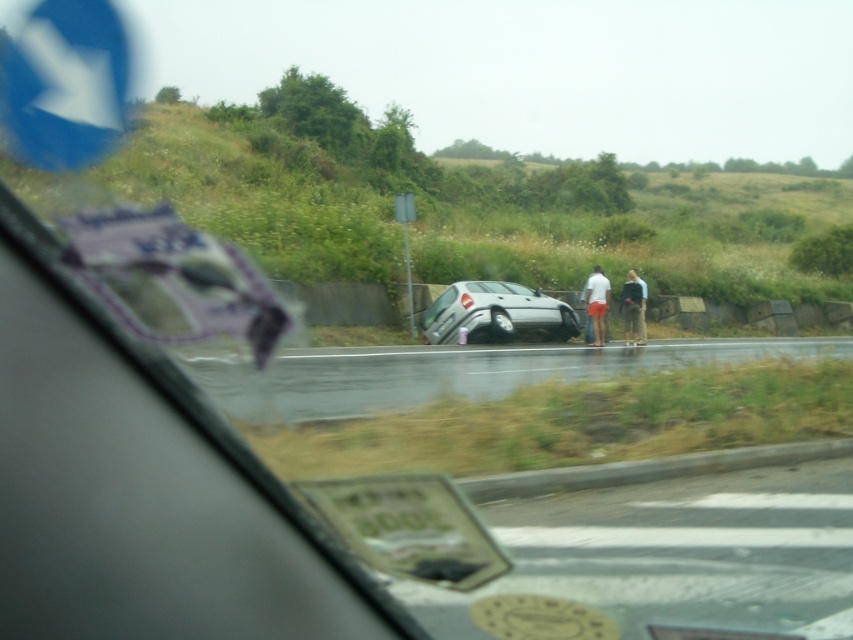
Question: Does matte white shorts at center have a larger size compared to light blue jeans at center?

Choices:
 (A) yes
 (B) no

Answer: (A)

Question: Which point appears farthest from the camera in this image?

Choices:
 (A) (471, 280)
 (B) (595, 269)
 (C) (631, 307)

Answer: (A)

Question: Is satin silver car at center wider than light blue jeans at center?

Choices:
 (A) no
 (B) yes

Answer: (B)

Question: Which point is closer to the camera taking this photo?

Choices:
 (A) (422, 346)
 (B) (497, 296)
 (C) (643, 340)

Answer: (A)

Question: Which object appears closest to the camera in this image?

Choices:
 (A) satin silver car at center
 (B) matte white shorts at center

Answer: (A)

Question: Can you confirm if satin silver car at center is wider than light blue jeans at center?

Choices:
 (A) yes
 (B) no

Answer: (A)